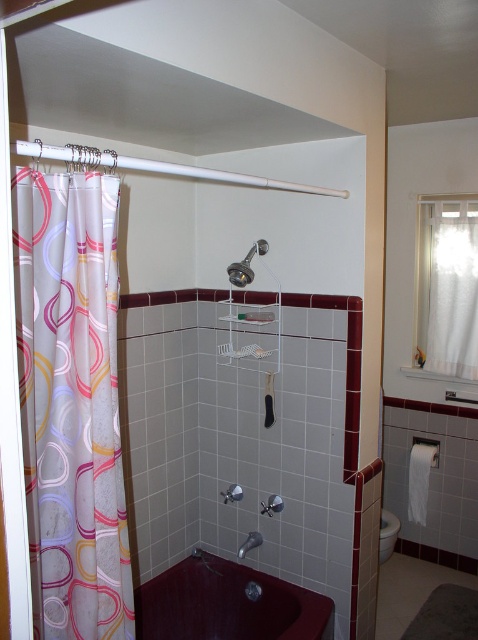
You are standing in the bathroom and want to see if the translucent fabric shower curtain at left is visible from the outside through the white sheer curtain at upper right. Can you see it?

The translucent fabric shower curtain at left is positioned under the white sheer curtain at upper right, so it would not be visible from outside through the white sheer curtain at upper right.

You are trying to determine which object takes up more space in the bathroom. Based on the scene, which one is smaller in size between the white plastic shower curtain at left and the metallic chrome shower head at upper center?

The white plastic shower curtain at left occupies less space than the metallic chrome shower head at upper center, so the white plastic shower curtain at left is smaller in size.

You are standing in the bathroom and need to reach the handheld showerhead. There is a white plastic shower curtain at left. Is the shower curtain in your way when you try to reach the showerhead?

The white plastic shower curtain at left is located at point (10, 397), which is to the left of the showerhead. Since the shower curtain is positioned to the left, it should not block your access to the handheld showerhead mounted on the wall. You can reach the showerhead without any obstruction from the curtain.